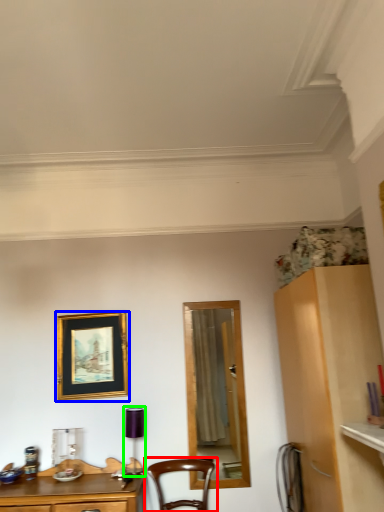
Question: Estimate the real-world distances between objects in this image. Which object is closer to chair (highlighted by a red box), picture frame (highlighted by a blue box) or lamp (highlighted by a green box)?

Choices:
 (A) picture frame
 (B) lamp

Answer: (B)